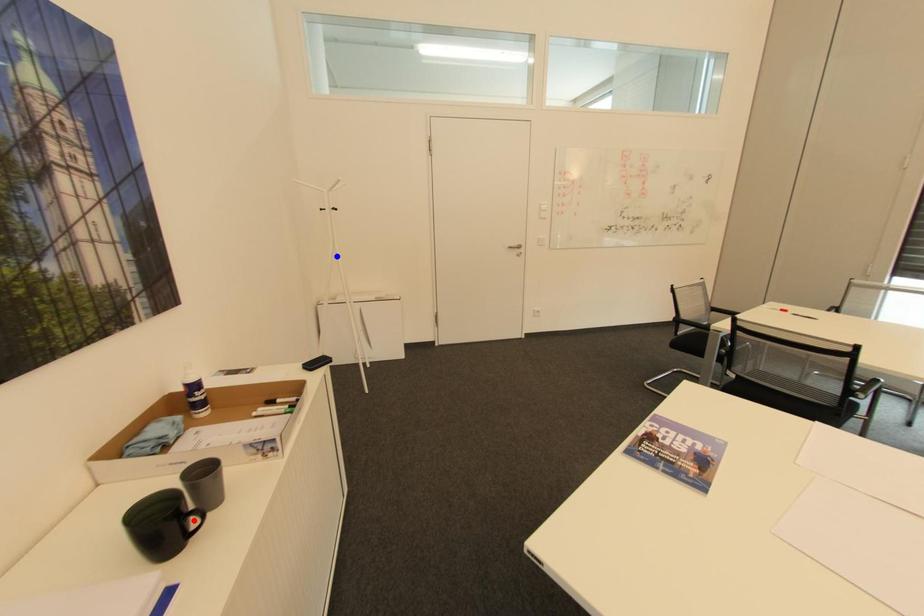
Question: Two points are marked on the image. Which point is closer to the camera?

Choices:
 (A) Blue point is closer.
 (B) Red point is closer.

Answer: (B)